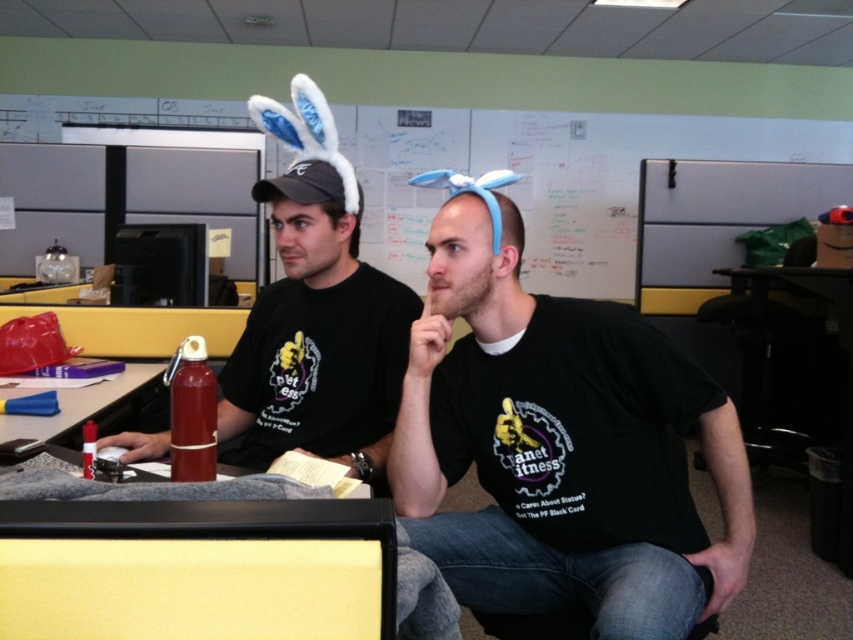
Question: Among these points, which one is nearest to the camera?

Choices:
 (A) (405, 291)
 (B) (100, 412)
 (C) (688, 300)

Answer: (A)

Question: Which point is farther from the camera taking this photo?

Choices:
 (A) (271, 419)
 (B) (457, 301)
 (C) (685, 276)

Answer: (C)

Question: Where is black matte t-shirt at center located in relation to white matte bulletin board at upper right in the image?

Choices:
 (A) right
 (B) left

Answer: (B)

Question: Is the position of matte black t-shirt at center more distant than that of metallic red thermos at left?

Choices:
 (A) no
 (B) yes

Answer: (A)

Question: Which point is closer to the camera?

Choices:
 (A) (107, 433)
 (B) (573, 358)
 (C) (242, 461)
 (D) (689, 294)

Answer: (B)

Question: Does matte black t-shirt at center have a lesser width compared to white matte bulletin board at upper right?

Choices:
 (A) no
 (B) yes

Answer: (B)